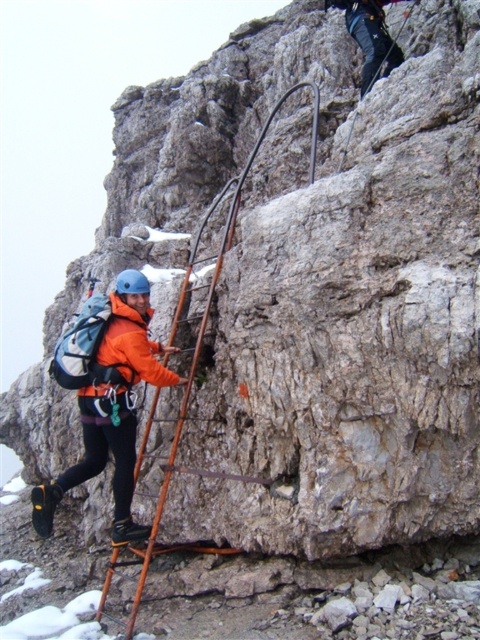
Question: Can you confirm if orange fabric jacket at left is positioned to the right of orange metal ladder at center?

Choices:
 (A) no
 (B) yes

Answer: (A)

Question: Is the position of orange fabric jacket at left less distant than that of orange metal ladder at center?

Choices:
 (A) yes
 (B) no

Answer: (B)

Question: Is orange fabric jacket at left to the right of orange metal ladder at center from the viewer's perspective?

Choices:
 (A) yes
 (B) no

Answer: (B)

Question: Which point is closer to the camera?

Choices:
 (A) orange metal ladder at center
 (B) orange fabric jacket at left

Answer: (A)

Question: Which point appears closest to the camera in this image?

Choices:
 (A) (103, 593)
 (B) (120, 301)

Answer: (A)

Question: Which object appears farthest from the camera in this image?

Choices:
 (A) orange fabric jacket at left
 (B) orange metal ladder at center

Answer: (A)